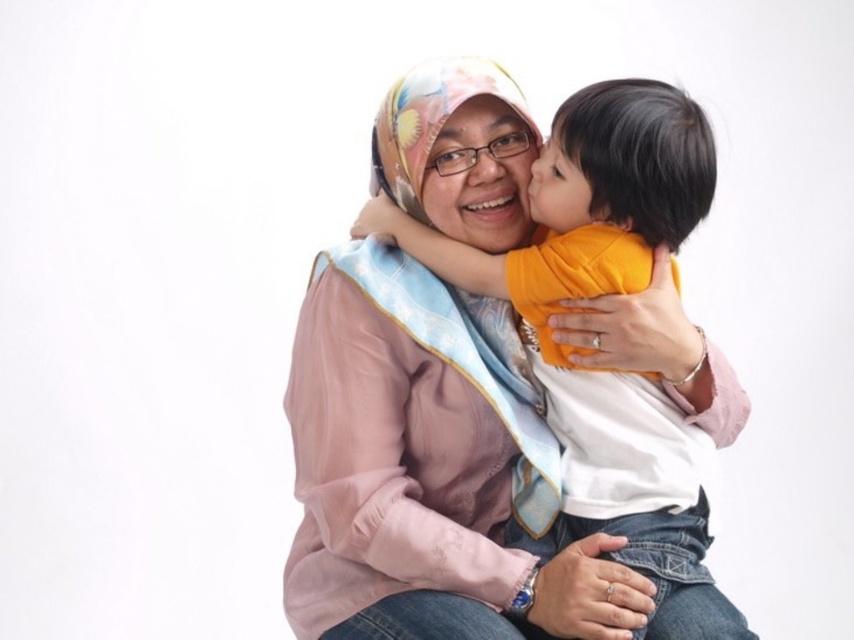
Question: Which object is closer to the camera taking this photo?

Choices:
 (A) matte yellow shirt at upper center
 (B) matte yellow shirt at center

Answer: (B)

Question: Is matte yellow shirt at center smaller than matte yellow shirt at upper center?

Choices:
 (A) no
 (B) yes

Answer: (A)

Question: Is matte yellow shirt at center to the right of matte yellow shirt at upper center from the viewer's perspective?

Choices:
 (A) no
 (B) yes

Answer: (B)

Question: Which of the following is the closest to the observer?

Choices:
 (A) matte yellow shirt at center
 (B) matte pink scarf at center
 (C) matte yellow shirt at upper center

Answer: (A)

Question: Is matte pink scarf at center smaller than matte yellow shirt at upper center?

Choices:
 (A) no
 (B) yes

Answer: (A)

Question: Which object is the farthest from the matte yellow shirt at upper center?

Choices:
 (A) matte pink scarf at center
 (B) matte yellow shirt at center

Answer: (B)